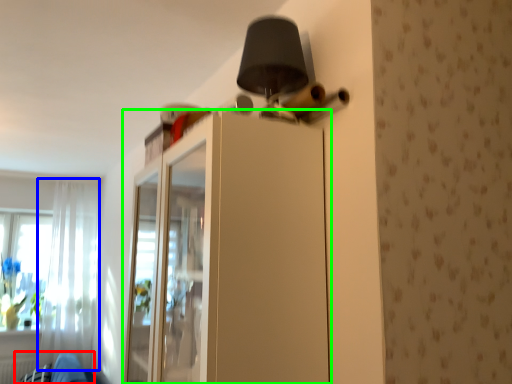
Question: Which object is positioned closest to swivel chair (highlighted by a red box)? Select from curtain (highlighted by a blue box) and dresser (highlighted by a green box).

Choices:
 (A) curtain
 (B) dresser

Answer: (A)